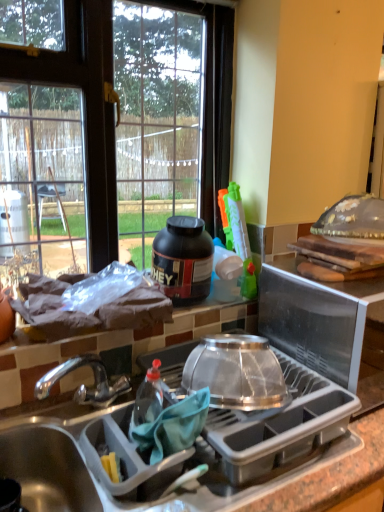
Identify the location of free spot to the right of transparent plastic bowl at center, which is the second kitchen appliance in top-to-bottom order. (315, 391).